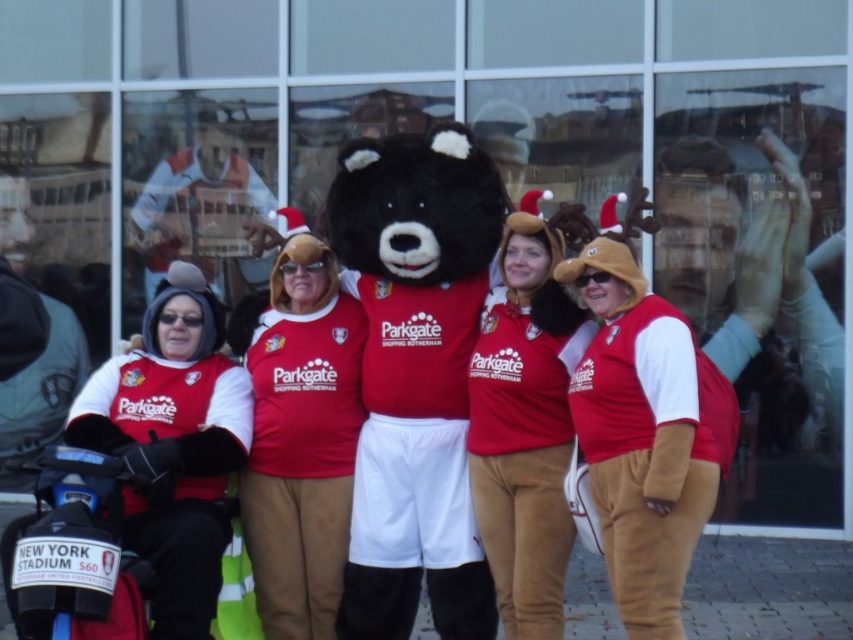
Does matte red vest at left have a greater height compared to velvet brown teddy bear at center?

No.

Who is positioned more to the left, matte red vest at left or velvet brown teddy bear at center?

matte red vest at left is more to the left.

Which is in front, point (183, 296) or point (569, 216)?

Point (569, 216)

What are the coordinates of `matte red vest at left` in the screenshot? It's located at (173, 445).

Is matte red jersey at center positioned at the back of velvet brown teddy bear at center?

Yes, matte red jersey at center is behind velvet brown teddy bear at center.

Is matte red jersey at center to the right of velvet brown teddy bear at center from the viewer's perspective?

Incorrect, matte red jersey at center is not on the right side of velvet brown teddy bear at center.

Between point (352, 310) and point (488, 369), which one is positioned in front?

Point (488, 369)

Locate an element on the screen. matte red jersey at center is located at coordinates (300, 440).

Can you confirm if matte red jersey at center is shorter than matte red vest at left?

Incorrect, matte red jersey at center's height does not fall short of matte red vest at left's.

In the scene shown: Between matte red jersey at center and matte red vest at left, which one appears on the right side from the viewer's perspective?

Positioned to the right is matte red jersey at center.

Where is `matte red jersey at center`? matte red jersey at center is located at coordinates (300, 440).